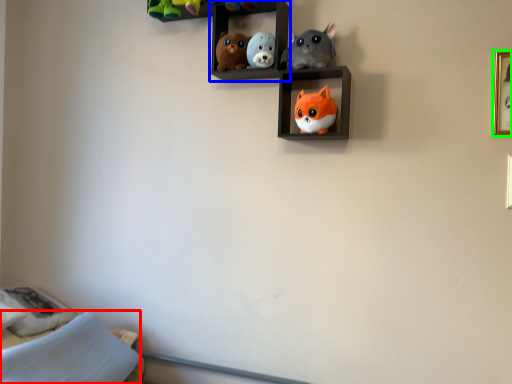
Question: Estimate the real-world distances between objects in this image. Which object is closer to pillow (highlighted by a red box), shelf (highlighted by a blue box) or picture frame (highlighted by a green box)?

Choices:
 (A) shelf
 (B) picture frame

Answer: (A)